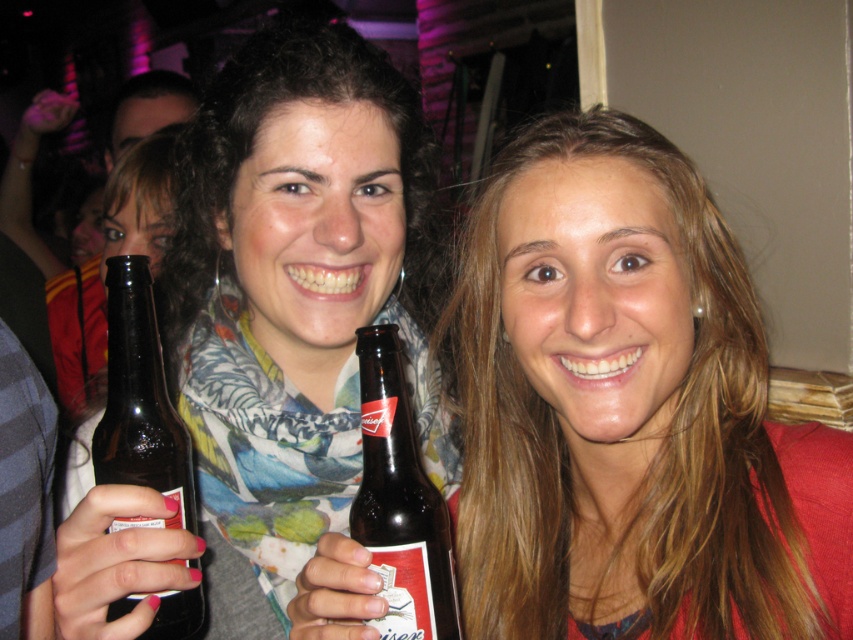
You are a bartender who needs to place two bottles on a shelf. The shelf has a space that is exactly 12 inches wide. You have the matte black bottle at left and the brown glass beer bottle at center. Can both bottles fit side by side in this space without overlapping?

The distance between the matte black bottle at left and brown glass beer bottle at center is 12.02 inches. Since the shelf space is exactly 12 inches wide, the bottles cannot fit side by side without overlapping because the required space is slightly larger than the available shelf width.

What are the coordinates of the matte brown bottle at center in the image?

The matte brown bottle at center is located at coordinates point [627,410].

You are taking a photo of two people at a party. The first person is holding a dark glass bottle with a red label and is at point (390,513). The second person is wearing a red garment and is at point (106,305). If you want to focus on the person closer to the camera, which point should you aim your camera at?

You should aim your camera at point (390,513) because it is closer to the camera than point (106,305).